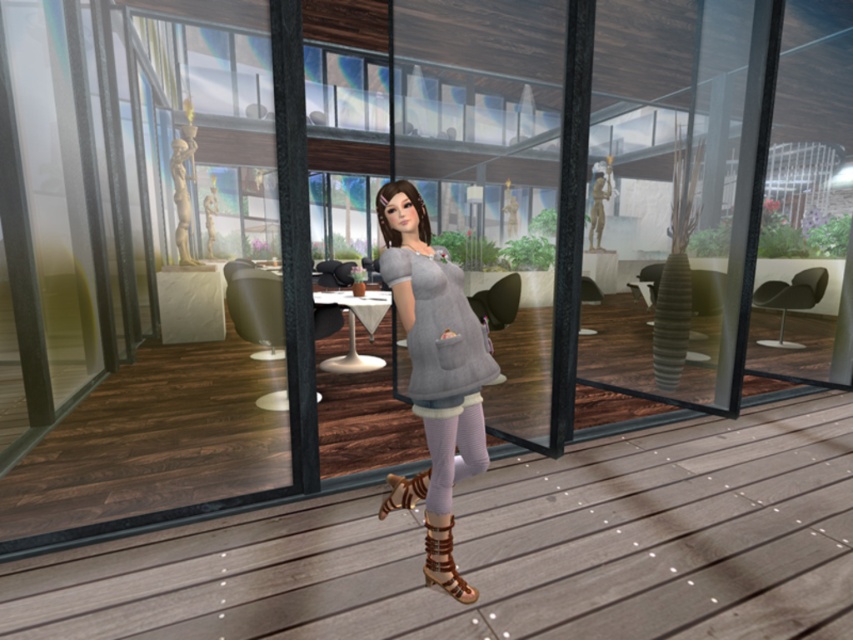
You are a fashion designer observing the character in the dining area. You notice the gray matte dress at center and the purple textured leggings at center. Which clothing item appears to be bigger in size?

The gray matte dress at center has a larger size compared to the purple textured leggings at center, so the gray matte dress at center appears bigger in size.

You are a character in a virtual game and need to reach the wooden deck at center. What are the coordinates where you should aim to land?

The wooden deck at center is located at coordinates point (506,548), so aim for those coordinates to land on it.